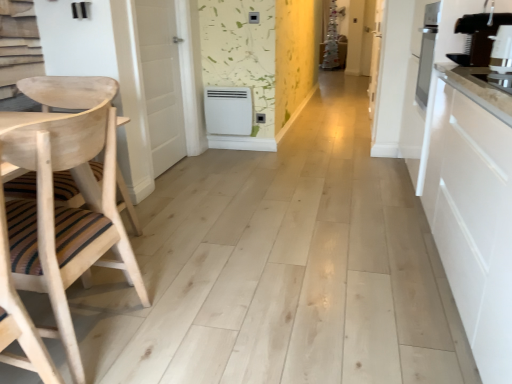
Identify the location of free location to the right of white smooth door at left, which appears as the first door when viewed from the left. This screenshot has width=512, height=384. pos(221,168).